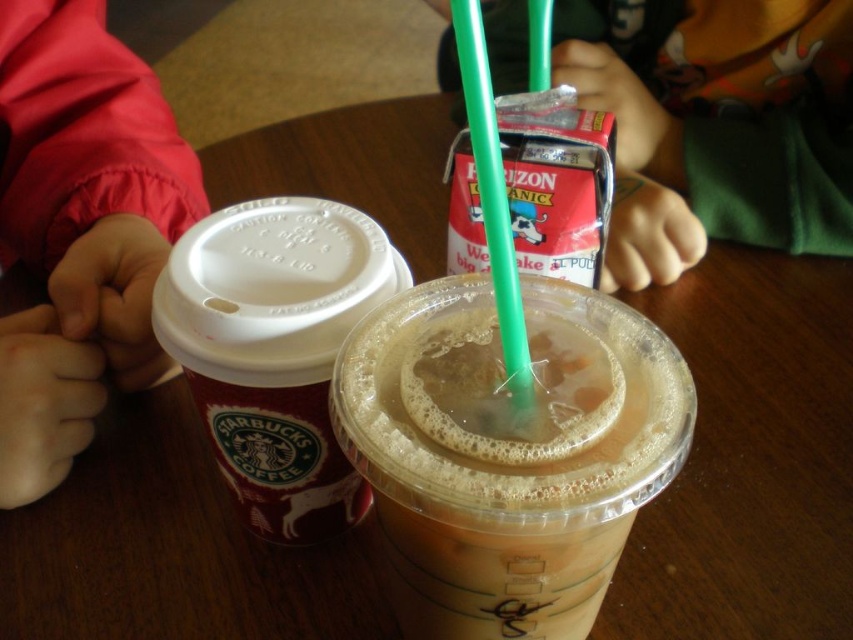
Does green plastic straw at upper center appear on the left side of green plastic straw at center?

Incorrect, green plastic straw at upper center is not on the left side of green plastic straw at center.

Does green plastic straw at upper center come in front of green plastic straw at center?

No, green plastic straw at upper center is behind green plastic straw at center.

The image size is (853, 640). Find the location of `green plastic straw at upper center`. green plastic straw at upper center is located at coordinates 717,124.

At what (x,y) coordinates should I click in order to perform the action: click on green plastic straw at upper center. Please return your answer as a coordinate pair (x, y). The width and height of the screenshot is (853, 640). Looking at the image, I should click on (717, 124).

Can you confirm if translucent plastic cup at center is shorter than matte red jacket at left?

Yes, translucent plastic cup at center is shorter than matte red jacket at left.

Which is behind, point (462, 577) or point (51, 468)?

The point (51, 468) is more distant.

Which is behind, point (444, 588) or point (42, 58)?

Positioned behind is point (42, 58).

This screenshot has height=640, width=853. I want to click on translucent plastic cup at center, so click(x=508, y=451).

Between green plastic straw at upper center and red matte starbucks coffee cup at left, which one has more height?

green plastic straw at upper center

Between green plastic straw at upper center and red matte starbucks coffee cup at left, which one has less height?

Standing shorter between the two is red matte starbucks coffee cup at left.

What are the coordinates of `green plastic straw at upper center` in the screenshot? It's located at (717, 124).